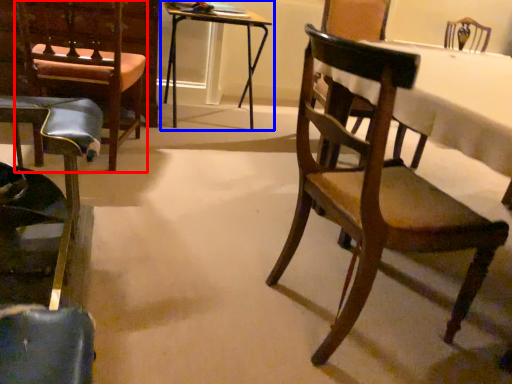
Question: Among these objects, which one is nearest to the camera, armchair (highlighted by a red box) or table (highlighted by a blue box)?

Choices:
 (A) armchair
 (B) table

Answer: (A)